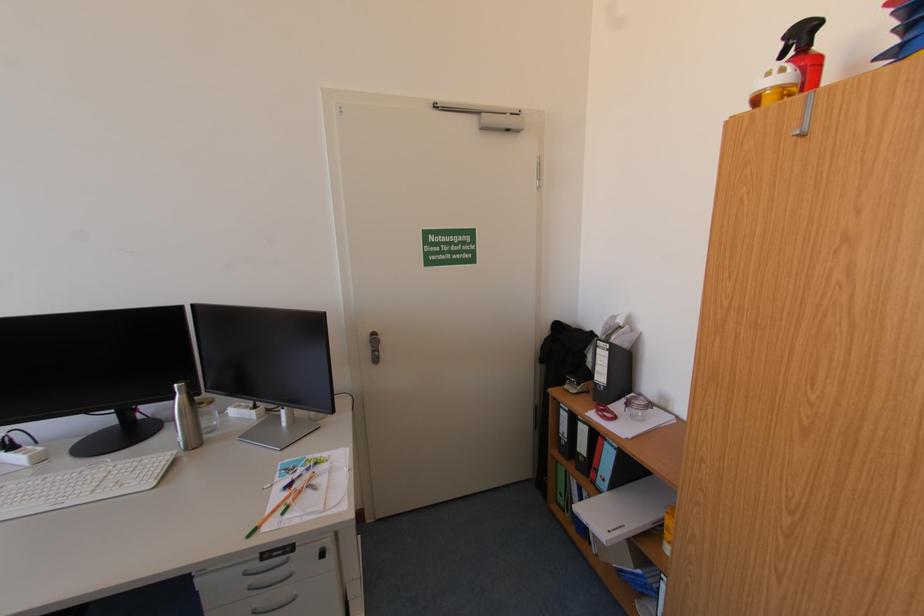
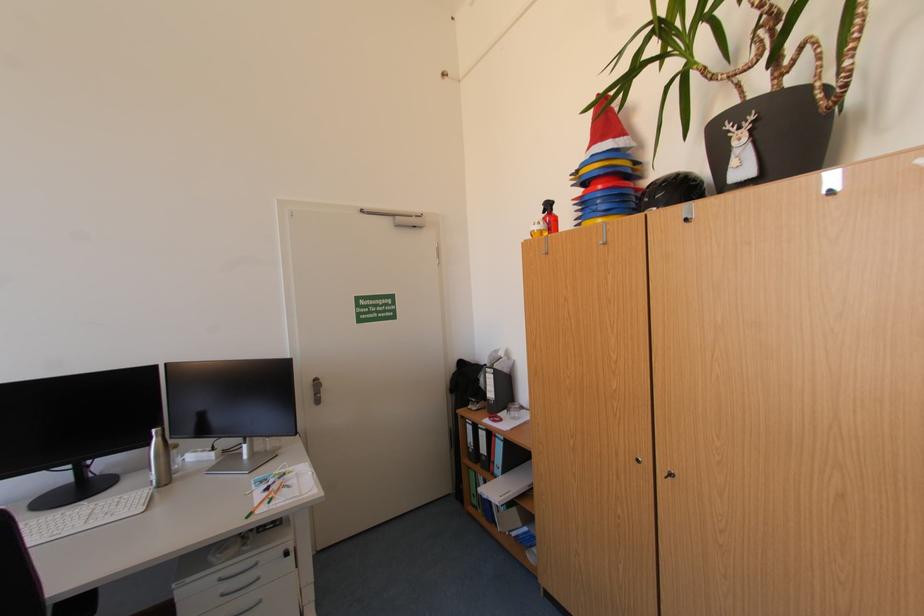
In the second image, find the point that corresponds to (x=188, y=309) in the first image.

(164, 368)